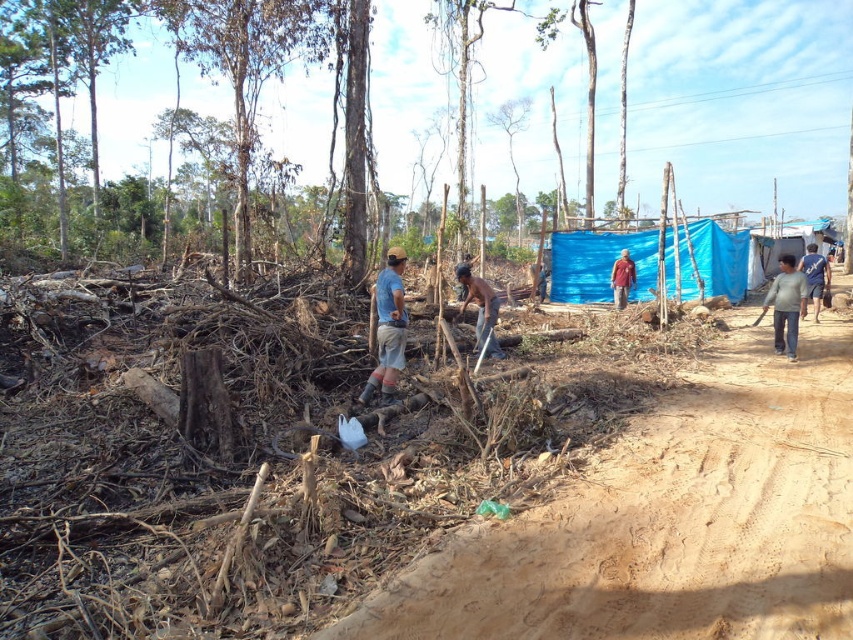
Is gray matte shirt at right in front of skinny man at center?

No, gray matte shirt at right is behind skinny man at center.

Is gray matte shirt at right thinner than skinny man at center?

Incorrect, gray matte shirt at right's width is not less than skinny man at center's.

Does point (785, 307) come farther from viewer compared to point (465, 300)?

No, it is not.

Locate an element on the screen. The image size is (853, 640). gray matte shirt at right is located at coordinates (786, 305).

Is blue fabric cap at center bigger than blue fabric at right?

No.

How far apart are blue fabric cap at center and blue fabric at right?

blue fabric cap at center and blue fabric at right are 29.47 feet apart.

Locate an element on the screen. This screenshot has width=853, height=640. blue fabric cap at center is located at coordinates (387, 328).

At what (x,y) coordinates should I click in order to perform the action: click on blue fabric cap at center. Please return your answer as a coordinate pair (x, y). Looking at the image, I should click on (387, 328).

Identify the location of brown sandy dirt at center. (668, 522).

Is the position of brown sandy dirt at center more distant than that of blue fabric at right?

No, it is not.

You are a GUI agent. You are given a task and a screenshot of the screen. Output one action in this format:
    pyautogui.click(x=<x>, y=<y>)
    Task: Click on the brown sandy dirt at center
    
    Given the screenshot: What is the action you would take?
    pyautogui.click(x=668, y=522)